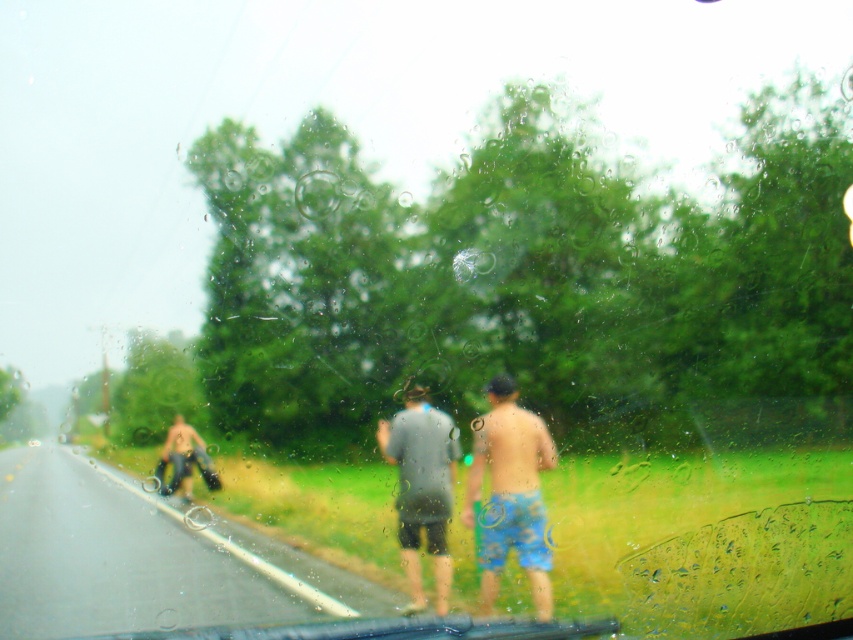
Question: Which is nearer to the denim jeans at left?

Choices:
 (A) gray matte shirt at center
 (B) blue printed shorts at right

Answer: (A)

Question: Which object is the closest to the denim jeans at left?

Choices:
 (A) blue printed shorts at right
 (B) gray matte shirt at center

Answer: (B)

Question: Is blue printed shorts at right thinner than denim jeans at left?

Choices:
 (A) yes
 (B) no

Answer: (A)

Question: Does blue printed shorts at right appear on the left side of denim jeans at left?

Choices:
 (A) yes
 (B) no

Answer: (B)

Question: Is gray matte shirt at center closer to camera compared to denim jeans at left?

Choices:
 (A) yes
 (B) no

Answer: (A)

Question: Which object is farther from the camera taking this photo?

Choices:
 (A) denim jeans at left
 (B) gray matte shirt at center
 (C) blue printed shorts at right

Answer: (A)